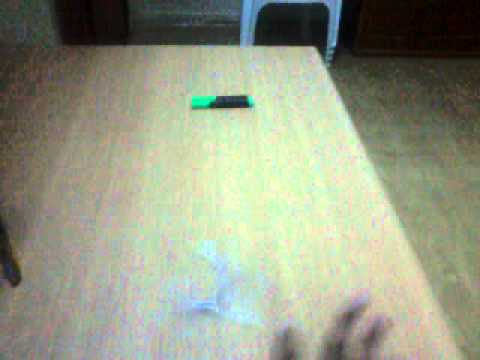
Identify the location of white stacked chairs. The image size is (480, 360). (294, 23), (334, 26).